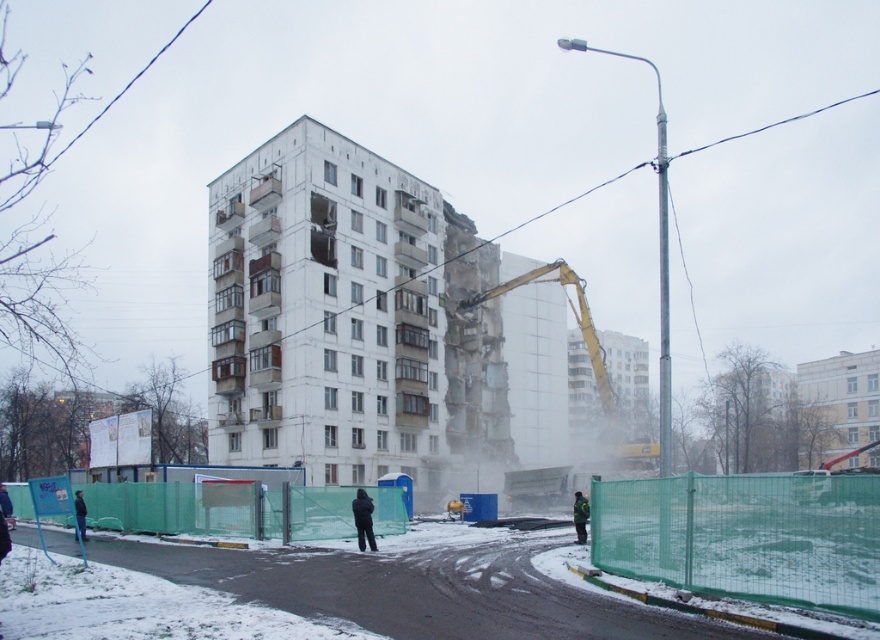
You are a safety inspector standing at the edge of the demolition site. You notice two people wearing jackets at the center of the scene. Which jacket is narrower in width between the black matte jacket at center and the green reflective jacket at center?

The black matte jacket at center has a lesser width compared to the green reflective jacket at center, so the black matte jacket at center is narrower.

You are a pedestrian trying to cross the street near the demolition site. You see the green mesh fence at lower center and the green reflective jacket at center. Which object is closer to you?

The green mesh fence at lower center is closer to the viewer than the green reflective jacket at center.